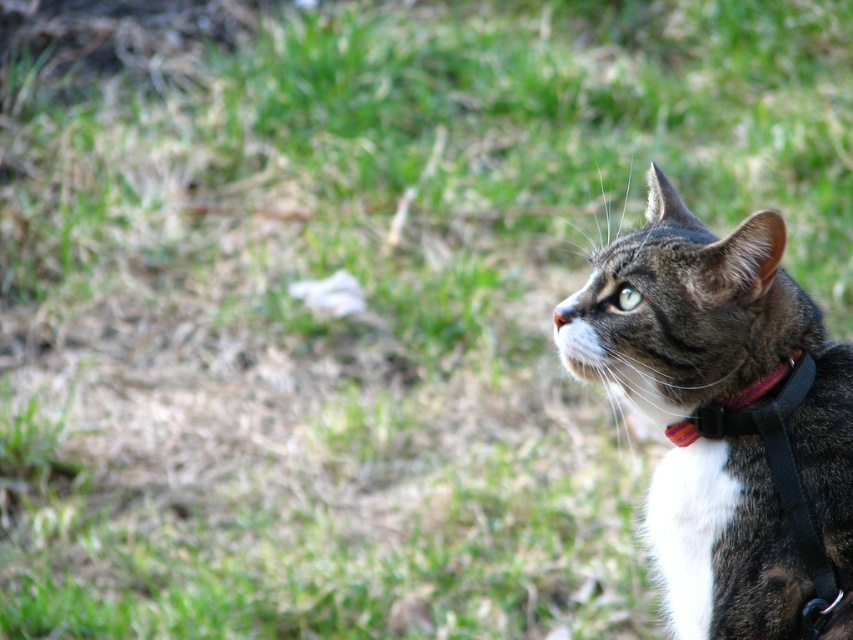
Who is lower down, tabby fur cat at right or multicolored fabric collar at right?

Positioned lower is multicolored fabric collar at right.

Is point (769, 580) positioned after point (722, 403)?

No.

Identify the location of tabby fur cat at right. (727, 419).